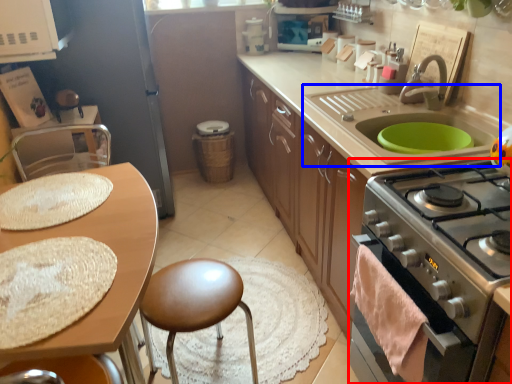
Question: Which of the following is the closest to the observer, kitchen appliance (highlighted by a red box) or sink (highlighted by a blue box)?

Choices:
 (A) kitchen appliance
 (B) sink

Answer: (A)